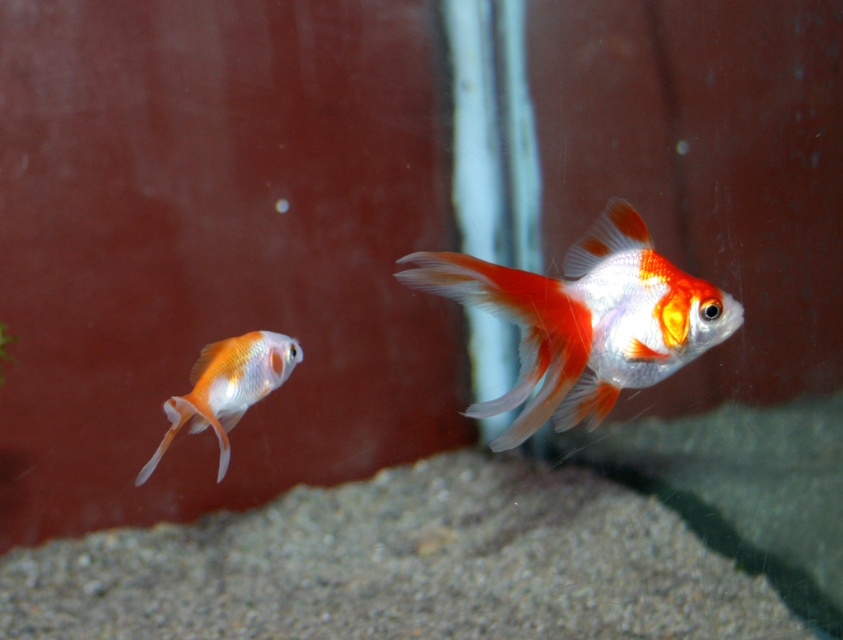
Describe the element at coordinates (584, 321) in the screenshot. The width and height of the screenshot is (843, 640). I see `shiny orange and white goldfish at center` at that location.

Who is more distant from viewer, (670, 333) or (247, 339)?

Point (247, 339)

Locate an element on the screen. shiny orange and white goldfish at center is located at coordinates (584, 321).

At what (x,y) coordinates should I click in order to perform the action: click on shiny orange and white goldfish at center. Please return your answer as a coordinate pair (x, y). The width and height of the screenshot is (843, 640). Looking at the image, I should click on [x=584, y=321].